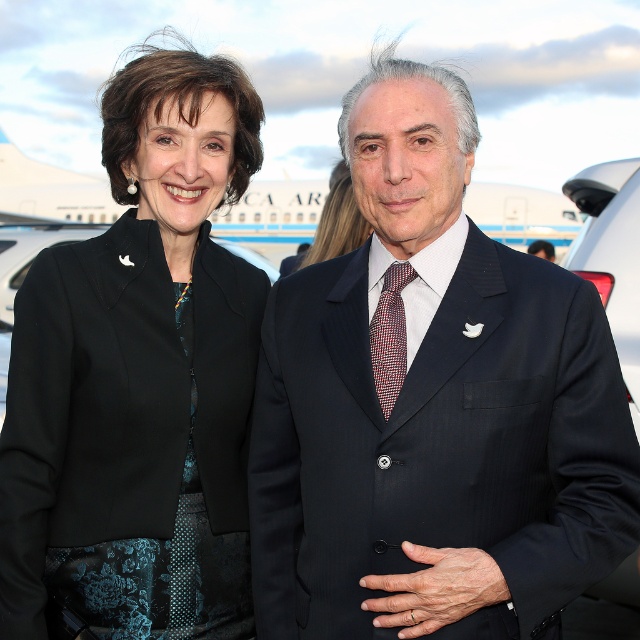
Question: Considering the real-world distances, which object is farthest from the plaid silk tie at center?

Choices:
 (A) dark blue pinstripe suit at center
 (B) black fabric jacket at upper left
 (C) matte black blazer at center

Answer: (C)

Question: Is plaid silk tie at center wider than matte black blazer at center?

Choices:
 (A) no
 (B) yes

Answer: (A)

Question: In this image, where is black fabric jacket at upper left located relative to plaid silk tie at center?

Choices:
 (A) above
 (B) below

Answer: (A)

Question: Does plaid silk tie at center have a larger size compared to matte black blazer at center?

Choices:
 (A) no
 (B) yes

Answer: (A)

Question: Which of the following is the closest to the observer?

Choices:
 (A) black fabric jacket at upper left
 (B) plaid silk tie at center
 (C) dark blue pinstripe suit at center

Answer: (C)

Question: Among these points, which one is farthest from the camera?

Choices:
 (A) (323, 564)
 (B) (49, 296)

Answer: (B)